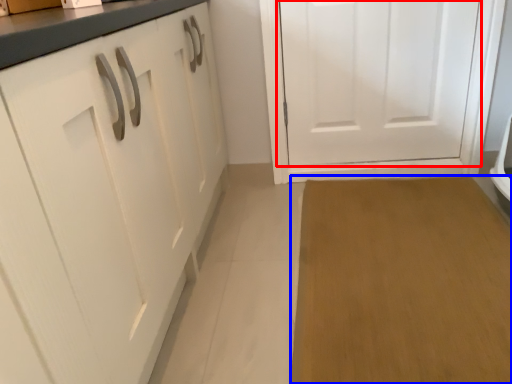
Question: Which object appears farthest to the camera in this image, door (highlighted by a red box) or plain (highlighted by a blue box)?

Choices:
 (A) door
 (B) plain

Answer: (A)